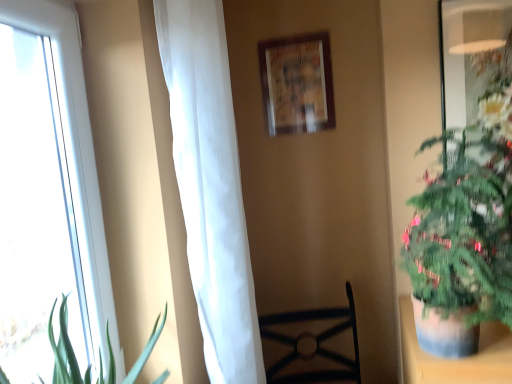
Question: In the image, is white sheer curtain at left positioned in front of or behind white glass window at left?

Choices:
 (A) behind
 (B) front

Answer: (A)

Question: In terms of width, does white sheer curtain at left look wider or thinner when compared to white glass window at left?

Choices:
 (A) thin
 (B) wide

Answer: (B)

Question: Based on their relative distances, which object is nearer to the green leafy plant at right?

Choices:
 (A) white sheer curtain at left
 (B) black metal chair at center
 (C) wooden picture frame at upper center
 (D) white glass window at left

Answer: (A)

Question: Based on their relative distances, which object is farther from the black metal chair at center?

Choices:
 (A) white sheer curtain at left
 (B) wooden picture frame at upper center
 (C) white glass window at left
 (D) green leafy plant at right

Answer: (C)